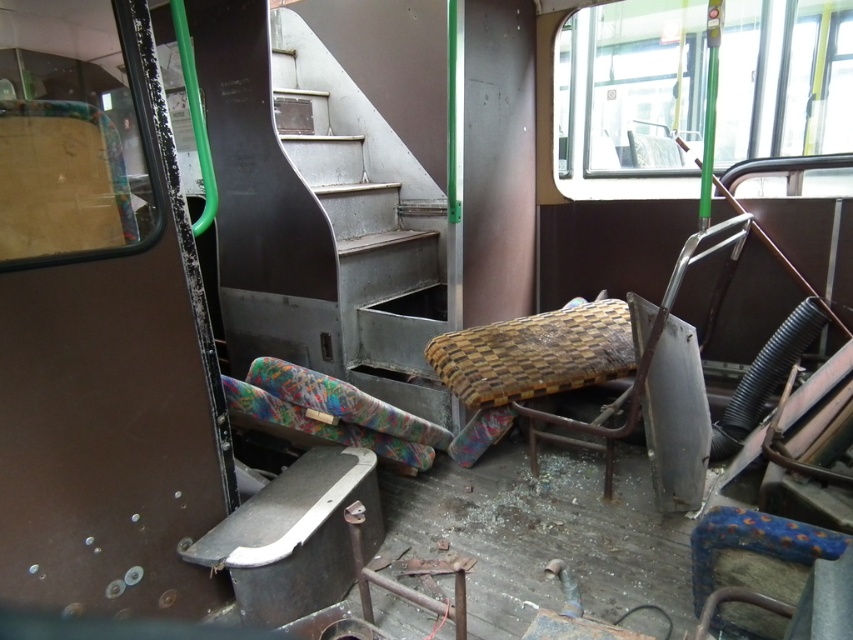
Question: Is woven fabric chair at center below multicolored fabric pillow at lower left?

Choices:
 (A) yes
 (B) no

Answer: (B)

Question: Is woven fabric chair at center smaller than multicolored fabric pillow at lower left?

Choices:
 (A) no
 (B) yes

Answer: (A)

Question: Which point is farther from the camera taking this photo?

Choices:
 (A) (439, 428)
 (B) (538, 349)

Answer: (A)

Question: Is woven fabric chair at center below multicolored fabric pillow at lower left?

Choices:
 (A) no
 (B) yes

Answer: (A)

Question: Which point is farther to the camera?

Choices:
 (A) (611, 339)
 (B) (316, 385)

Answer: (A)

Question: Which point appears closest to the camera in this image?

Choices:
 (A) (537, 435)
 (B) (376, 413)

Answer: (B)